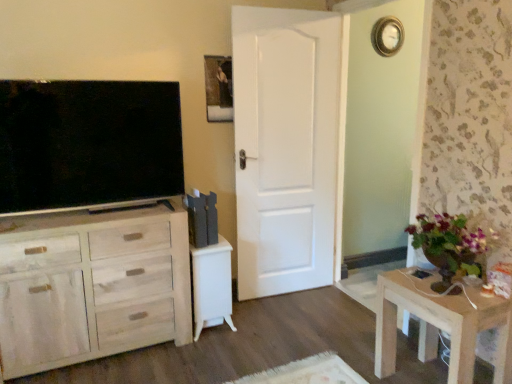
The image size is (512, 384). In order to click on wooden table at lower right in this screenshot , I will do `click(441, 325)`.

What do you see at coordinates (92, 286) in the screenshot?
I see `light wood cabinet at left` at bounding box center [92, 286].

In order to face light wood cabinet at left, should I rotate leftwards or rightwards?

Turn left by 21.079 degrees to look at light wood cabinet at left.

This screenshot has height=384, width=512. Identify the location of gold-toned metallic clock at upper right. (387, 36).

In order to click on matte black tv at left in this screenshot , I will do `click(88, 144)`.

What do you see at coordinates (285, 147) in the screenshot? I see `white painted wood door at center` at bounding box center [285, 147].

The image size is (512, 384). I want to click on wooden table at lower right, so click(441, 325).

Looking at this image, considering the sizes of wooden picture frame at upper center and light wood cabinet at left in the image, is wooden picture frame at upper center taller or shorter than light wood cabinet at left?

wooden picture frame at upper center is shorter than light wood cabinet at left.

At what (x,y) coordinates should I click in order to perform the action: click on cabinetry below the wooden picture frame at upper center (from a real-world perspective). Please return your answer as a coordinate pair (x, y). This screenshot has height=384, width=512. Looking at the image, I should click on click(92, 286).

Could you tell me if wooden picture frame at upper center is turned towards light wood cabinet at left?

No, wooden picture frame at upper center is not aimed at light wood cabinet at left.

From a real-world perspective, who is located higher, gold-toned metallic clock at upper right or white glossy vanity at center?

gold-toned metallic clock at upper right.

Can you confirm if gold-toned metallic clock at upper right is positioned to the left of white glossy vanity at center?

No, gold-toned metallic clock at upper right is not to the left of white glossy vanity at center.

From the image's perspective, would you say gold-toned metallic clock at upper right is positioned over white glossy vanity at center?

Yes, from the image's perspective, gold-toned metallic clock at upper right is on top of white glossy vanity at center.

Considering the sizes of gold-toned metallic clock at upper right and white glossy vanity at center in the image, is gold-toned metallic clock at upper right bigger or smaller than white glossy vanity at center?

Clearly, gold-toned metallic clock at upper right is smaller in size than white glossy vanity at center.

Where is `door above the wooden table at lower right (from a real-world perspective)`? door above the wooden table at lower right (from a real-world perspective) is located at coordinates (285, 147).

Is white painted wood door at center next to wooden table at lower right?

white painted wood door at center and wooden table at lower right are not in contact.

In the scene shown: From the image's perspective, is white painted wood door at center located above or below wooden table at lower right?

white painted wood door at center is above wooden table at lower right.

How many degrees apart are the facing directions of white painted wood door at center and wooden table at lower right?

white painted wood door at center and wooden table at lower right are facing 85.2 degrees away from each other.

Considering the sizes of white glossy vanity at center and gold-toned metallic clock at upper right in the image, is white glossy vanity at center wider or thinner than gold-toned metallic clock at upper right?

Clearly, white glossy vanity at center has more width compared to gold-toned metallic clock at upper right.

Is white glossy vanity at center next to gold-toned metallic clock at upper right?

white glossy vanity at center and gold-toned metallic clock at upper right are not in contact.

Where is `vanity lying on the left of gold-toned metallic clock at upper right`? The height and width of the screenshot is (384, 512). vanity lying on the left of gold-toned metallic clock at upper right is located at coordinates (212, 285).

Can you confirm if light wood cabinet at left is shorter than white glossy vanity at center?

No, light wood cabinet at left is not shorter than white glossy vanity at center.

Considering the sizes of light wood cabinet at left and white glossy vanity at center in the image, is light wood cabinet at left bigger or smaller than white glossy vanity at center?

Considering their sizes, light wood cabinet at left takes up more space than white glossy vanity at center.

Considering the points (95, 224) and (203, 313), which point is behind, point (95, 224) or point (203, 313)?

The point (203, 313) is behind.

Which object is positioned more to the left, light wood cabinet at left or white glossy vanity at center?

light wood cabinet at left.

Is matte black tv at left facing away from white glossy vanity at center?

No, matte black tv at left is not facing the opposite direction of white glossy vanity at center.

This screenshot has height=384, width=512. In order to click on vanity on the right of matte black tv at left in this screenshot , I will do `click(212, 285)`.

Is matte black tv at left shorter than white glossy vanity at center?

No, matte black tv at left is not shorter than white glossy vanity at center.

This screenshot has height=384, width=512. I want to click on picture frame behind the matte black tv at left, so click(218, 88).

How different are the orientations of matte black tv at left and wooden picture frame at upper center in degrees?

The angle between the facing direction of matte black tv at left and the facing direction of wooden picture frame at upper center is 0.0024 degrees.

Considering the positions of objects matte black tv at left and wooden picture frame at upper center in the image provided, who is more to the left, matte black tv at left or wooden picture frame at upper center?

matte black tv at left is more to the left.

Considering the sizes of matte black tv at left and wooden picture frame at upper center in the image, is matte black tv at left taller or shorter than wooden picture frame at upper center?

In the image, matte black tv at left appears to be taller than wooden picture frame at upper center.

Where is `cabinetry beneath the wooden picture frame at upper center (from a real-world perspective)`? This screenshot has height=384, width=512. cabinetry beneath the wooden picture frame at upper center (from a real-world perspective) is located at coordinates (92, 286).

Identify the location of clock on the right of the white glossy vanity at center. (387, 36).

Based on the photo, from the image, which object appears to be nearer to light wood cabinet at left, wooden picture frame at upper center or white painted wood door at center?

white painted wood door at center is positioned closer to the anchor light wood cabinet at left.

Which object lies nearer to the anchor point white glossy vanity at center, gold-toned metallic clock at upper right or light wood cabinet at left?

Among the two, light wood cabinet at left is located nearer to white glossy vanity at center.

Which object lies further to the anchor point matte black tv at left, white glossy vanity at center or light wood cabinet at left?

white glossy vanity at center is further to matte black tv at left.

Based on their spatial positions, is white painted wood door at center or gold-toned metallic clock at upper right further from matte black tv at left?

gold-toned metallic clock at upper right.

When comparing their distances from gold-toned metallic clock at upper right, does white painted wood door at center or matte black tv at left seem further?

matte black tv at left.

Considering their positions, is wooden table at lower right positioned closer to gold-toned metallic clock at upper right than light wood cabinet at left?

The object closer to gold-toned metallic clock at upper right is wooden table at lower right.

Considering their positions, is white glossy vanity at center positioned further to gold-toned metallic clock at upper right than light wood cabinet at left?

The object further to gold-toned metallic clock at upper right is light wood cabinet at left.

When comparing their distances from light wood cabinet at left, does white painted wood door at center or white glossy vanity at center seem further?

white painted wood door at center is further to light wood cabinet at left.

Identify the location of vanity situated between light wood cabinet at left and white painted wood door at center from left to right. (212, 285).

Where is `picture frame between gold-toned metallic clock at upper right and white glossy vanity at center from top to bottom`? Image resolution: width=512 pixels, height=384 pixels. picture frame between gold-toned metallic clock at upper right and white glossy vanity at center from top to bottom is located at coordinates (218, 88).

Locate an element on the screen. The image size is (512, 384). door that lies between gold-toned metallic clock at upper right and white glossy vanity at center from top to bottom is located at coordinates (285, 147).

Where is `vanity situated between matte black tv at left and white painted wood door at center from left to right`? The image size is (512, 384). vanity situated between matte black tv at left and white painted wood door at center from left to right is located at coordinates (212, 285).